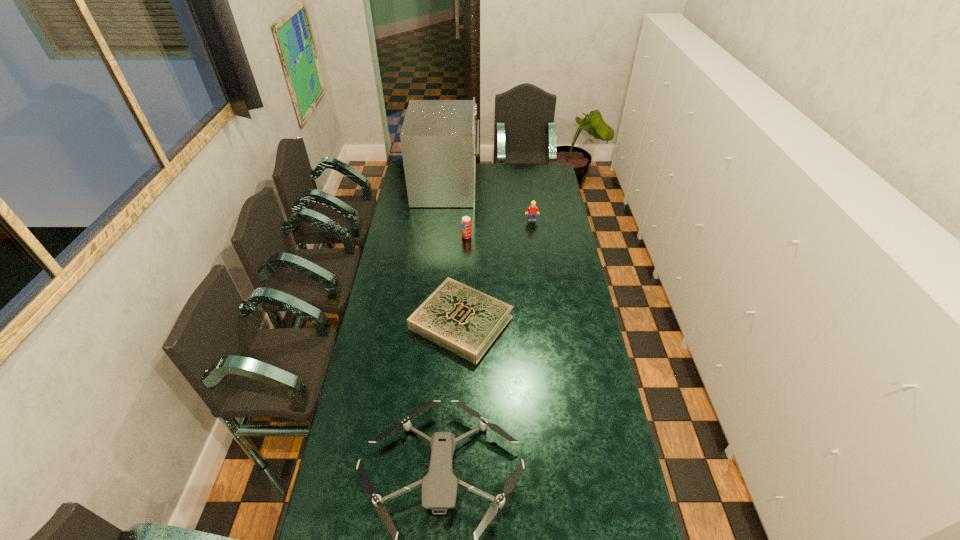
Locate an element on the screen. This screenshot has height=540, width=960. vacant space situated on the front of the fourth farthest object is located at coordinates (459, 378).

The height and width of the screenshot is (540, 960). Find the location of `object that is positioned at the far edge`. object that is positioned at the far edge is located at coordinates [437, 138].

Identify the location of object that is at the left edge. (437, 138).

Locate an element on the screen. The image size is (960, 540). object positioned at the right edge is located at coordinates (531, 211).

The width and height of the screenshot is (960, 540). Identify the location of object located in the far left corner section of the desktop. (437, 138).

Locate an element on the screen. The height and width of the screenshot is (540, 960). vacant space at the left edge is located at coordinates (392, 286).

The width and height of the screenshot is (960, 540). In order to click on free space at the right edge in this screenshot , I will do `click(605, 487)`.

In the image, there is a desktop. What are the coordinates of `vacant area at the far right corner` in the screenshot? It's located at (530, 181).

Where is `free spot between the tallest object and the rightmost object`? Image resolution: width=960 pixels, height=540 pixels. free spot between the tallest object and the rightmost object is located at coordinates 490,203.

At what (x,y) coordinates should I click in order to perform the action: click on vacant point located between the hardback book and the rightmost object. Please return your answer as a coordinate pair (x, y). Looking at the image, I should click on point(496,271).